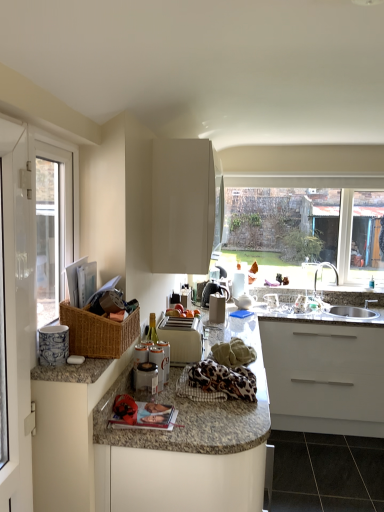
Question: Considering the relative positions of white plastic window frame at left and white glossy cabinet at upper center, placed as the 1th cabinetry when sorted from top to bottom, in the image provided, is white plastic window frame at left to the right of white glossy cabinet at upper center, placed as the 1th cabinetry when sorted from top to bottom, from the viewer's perspective?

Choices:
 (A) yes
 (B) no

Answer: (B)

Question: Can you confirm if white plastic window frame at left is bigger than white glossy cabinet at upper center, placed as the 1th cabinetry when sorted from top to bottom?

Choices:
 (A) yes
 (B) no

Answer: (B)

Question: Does white plastic window frame at left have a smaller size compared to white glossy cabinet at upper center, placed as the 1th cabinetry when sorted from top to bottom?

Choices:
 (A) no
 (B) yes

Answer: (B)

Question: Considering the relative sizes of white plastic window frame at left and white glossy cabinet at upper center, which appears as the second cabinetry when ordered from the bottom, in the image provided, is white plastic window frame at left wider than white glossy cabinet at upper center, which appears as the second cabinetry when ordered from the bottom,?

Choices:
 (A) yes
 (B) no

Answer: (B)

Question: Is white plastic window frame at left closer to camera compared to white glossy cabinet at upper center, placed as the 1th cabinetry when sorted from top to bottom?

Choices:
 (A) yes
 (B) no

Answer: (A)

Question: Is white plastic window frame at left not close to white glossy cabinet at upper center, which appears as the second cabinetry when ordered from the bottom?

Choices:
 (A) no
 (B) yes

Answer: (A)

Question: Considering the relative sizes of leopard print fabric at center and white plastic toaster at center, marked as the 3th appliance in a right-to-left arrangement, in the image provided, is leopard print fabric at center taller than white plastic toaster at center, marked as the 3th appliance in a right-to-left arrangement,?

Choices:
 (A) yes
 (B) no

Answer: (B)

Question: Is the position of leopard print fabric at center less distant than that of white plastic toaster at center, marked as the 3th appliance in a right-to-left arrangement?

Choices:
 (A) no
 (B) yes

Answer: (B)

Question: Can you confirm if leopard print fabric at center is wider than white plastic toaster at center, which is the 3th appliance in front-to-back order?

Choices:
 (A) yes
 (B) no

Answer: (A)

Question: Considering the relative positions of leopard print fabric at center and white plastic toaster at center, marked as the third appliance in a back-to-front arrangement, in the image provided, is leopard print fabric at center to the left of white plastic toaster at center, marked as the third appliance in a back-to-front arrangement, from the viewer's perspective?

Choices:
 (A) yes
 (B) no

Answer: (B)

Question: Does leopard print fabric at center come behind white plastic toaster at center, which is the 3th appliance in front-to-back order?

Choices:
 (A) yes
 (B) no

Answer: (B)

Question: Is leopard print fabric at center looking in the opposite direction of white plastic toaster at center, positioned as the 3th appliance in left-to-right order?

Choices:
 (A) no
 (B) yes

Answer: (A)

Question: From a real-world perspective, is satin silver sink at lower right located higher than leopard print fabric at center?

Choices:
 (A) no
 (B) yes

Answer: (A)